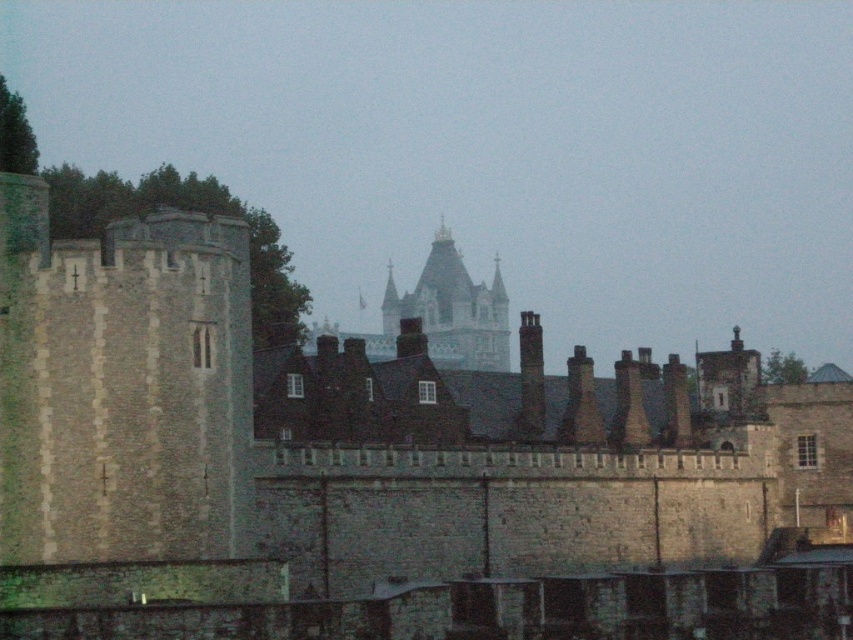
Question: Is stone tower at left positioned behind stone spire at center?

Choices:
 (A) no
 (B) yes

Answer: (A)

Question: Which object appears closest to the camera in this image?

Choices:
 (A) stone spire at center
 (B) stone tower at left

Answer: (B)

Question: Which point is closer to the camera?

Choices:
 (A) stone spire at center
 (B) stone tower at left

Answer: (B)

Question: Is stone tower at left closer to camera compared to stone spire at center?

Choices:
 (A) yes
 (B) no

Answer: (A)

Question: Can you confirm if stone tower at left is bigger than stone spire at center?

Choices:
 (A) no
 (B) yes

Answer: (A)